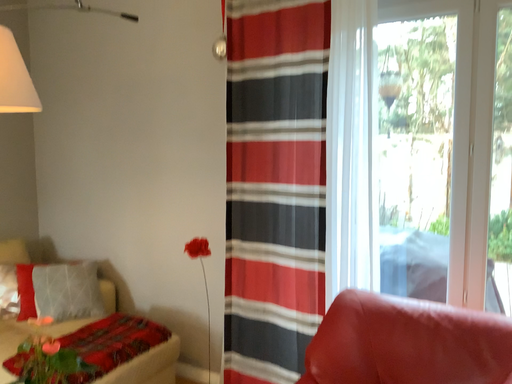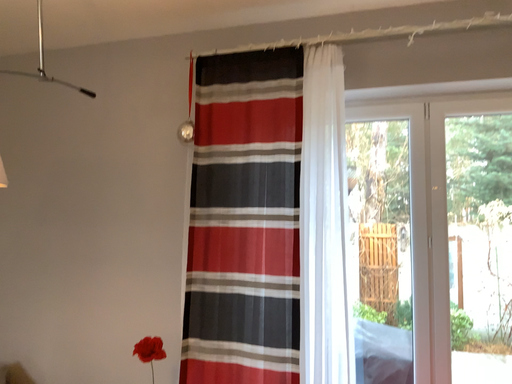
Question: How did the camera likely rotate when shooting the video?

Choices:
 (A) rotated right
 (B) rotated left

Answer: (A)